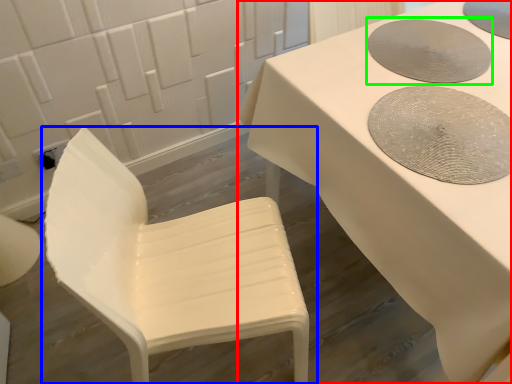
Question: Which object is positioned farthest from table (highlighted by a red box)? Select from chair (highlighted by a blue box) and manhole cover (highlighted by a green box).

Choices:
 (A) chair
 (B) manhole cover

Answer: (A)